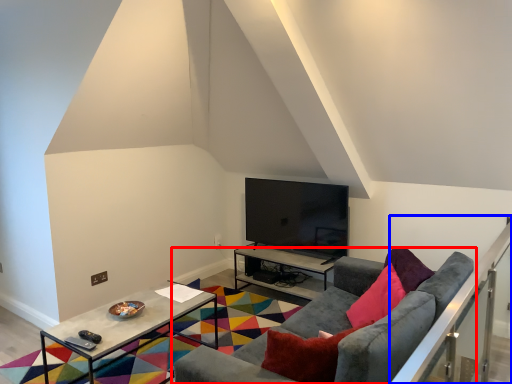
Question: Which point is closer to the camera, studio couch (highlighted by a red box) or balustrade (highlighted by a blue box)?

Choices:
 (A) studio couch
 (B) balustrade

Answer: (B)